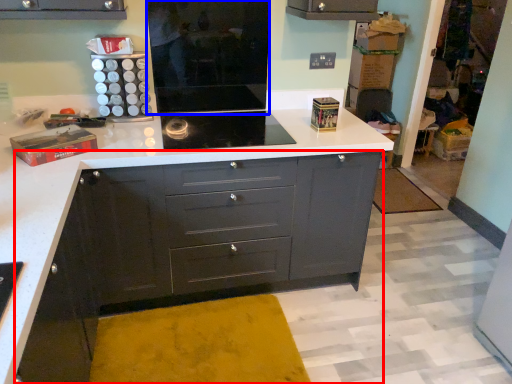
Question: Which of the following is the closest to the observer, chest of drawers (highlighted by a red box) or appliance (highlighted by a blue box)?

Choices:
 (A) chest of drawers
 (B) appliance

Answer: (A)